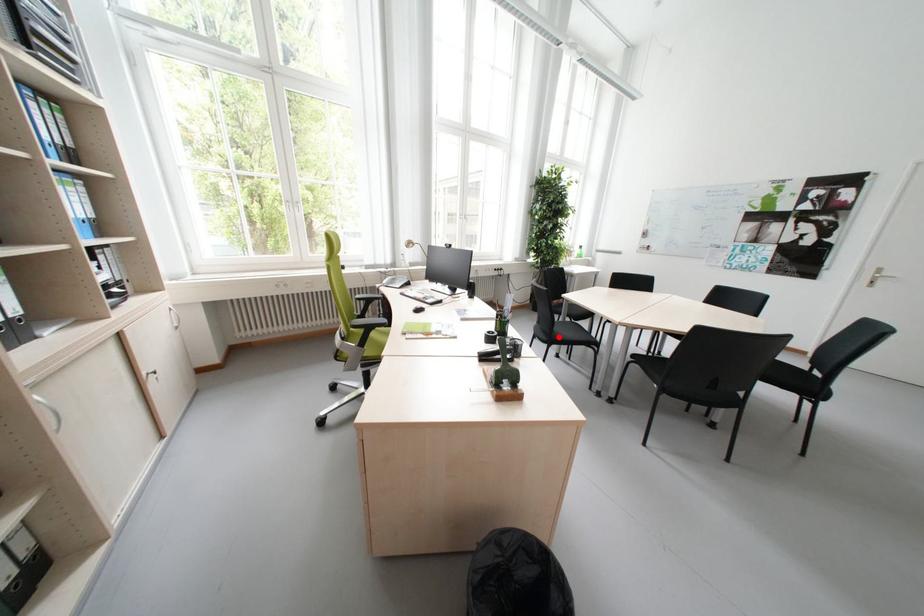
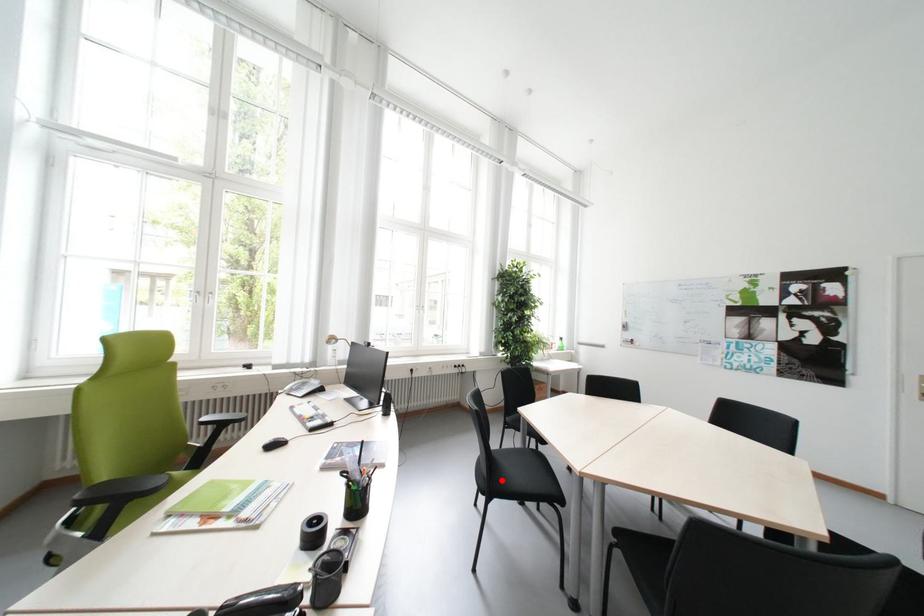
I am providing you with two images of the same scene from different viewpoints. A red point is marked on the first image and another point is marked on the second image. Is the marked point in image1 the same physical position as the marked point in image2?

Yes